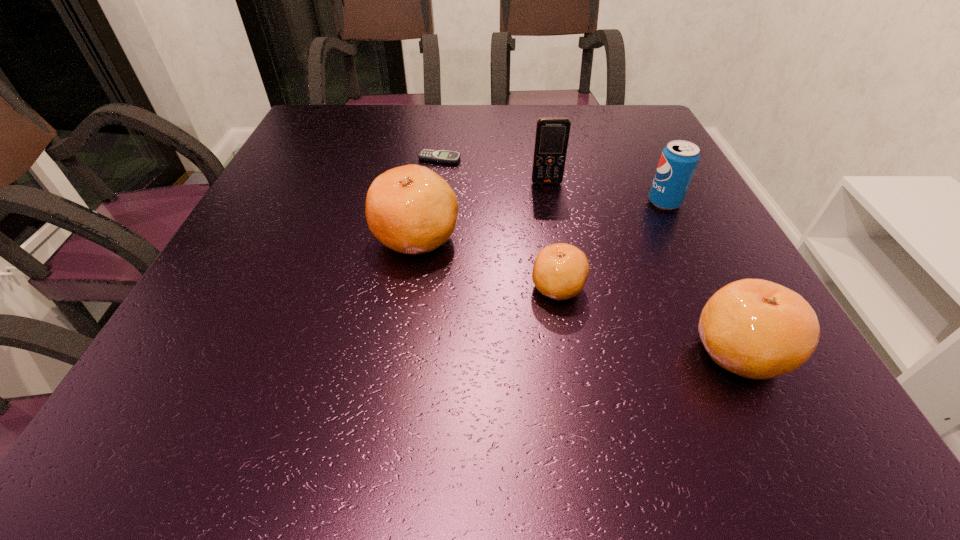
Locate an element on the screen. This screenshot has height=540, width=960. vacant region located 0.320m on the back of the shortest clementine is located at coordinates (539, 174).

I want to click on free space located on the left of the nearest object, so click(x=613, y=351).

I want to click on vacant space located 0.280m on the screen of the fifth nearest object, so click(564, 271).

Identify the location of vacant space located on the left of the soda can. (468, 202).

The image size is (960, 540). Identify the location of free space located 0.090m on the front of the beeper. (436, 186).

Locate an element on the screen. Image resolution: width=960 pixels, height=540 pixels. object present at the near edge is located at coordinates (754, 328).

Find the location of a particular element. clementine at the right edge is located at coordinates (754, 328).

Find the location of `soda can present at the right edge`. soda can present at the right edge is located at coordinates (679, 159).

You are a GUI agent. You are given a task and a screenshot of the screen. Output one action in this format:
    pyautogui.click(x=<x>, y=<y>)
    Task: Click on the object that is at the near right corner
    The image size is (960, 540).
    Given the screenshot: What is the action you would take?
    pyautogui.click(x=754, y=328)

In the image, there is a desktop. Where is `vacant area at the far edge`? The width and height of the screenshot is (960, 540). vacant area at the far edge is located at coordinates (419, 107).